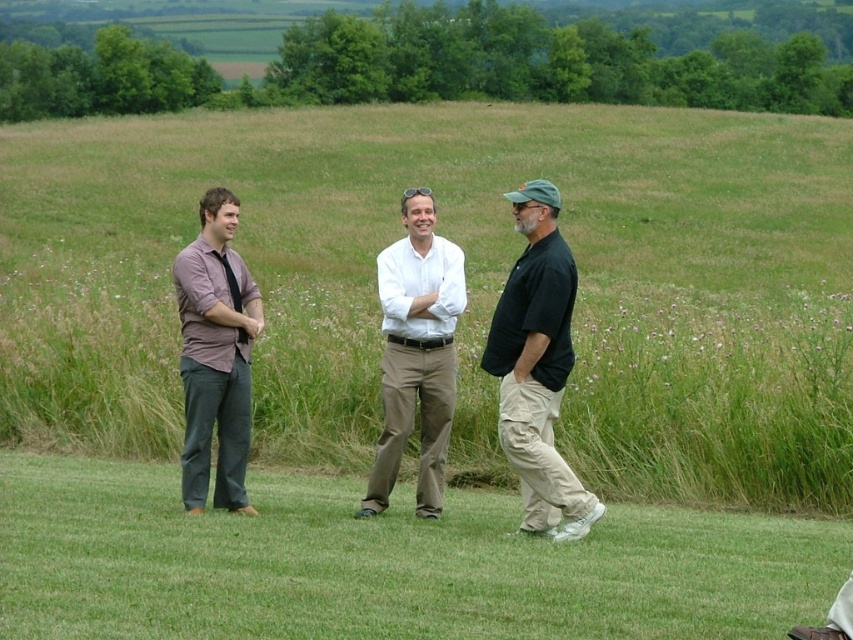
You are a photographer trying to capture a group photo of the khaki pants at right and the matte purple shirt at left. Since you want to ensure both subjects are clearly visible, which clothing item should you focus on first to avoid blurriness due to their sizes?

The khaki pants at right has a lesser width compared to the matte purple shirt at left, so you should focus on the khaki pants at right first to ensure clarity since it is smaller and might be harder to capture clearly.

You are a photographer trying to capture a candid shot of the two men wearing khaki pants at right and light brown cotton pants at center. Since you want to include both in the frame, which direction should you move your camera to ensure both are visible?

Since the khaki pants at right is to the right of light brown cotton pants at center, you should pan your camera slightly to the right to include both the khaki pants at right and light brown cotton pants at center in the frame.